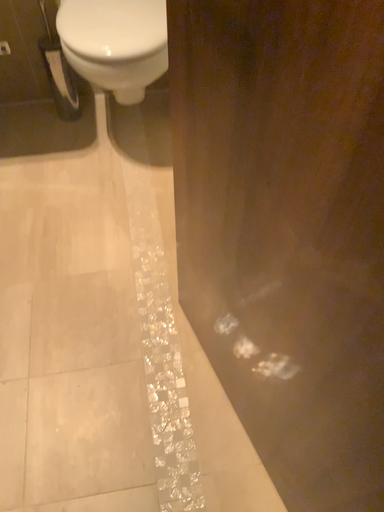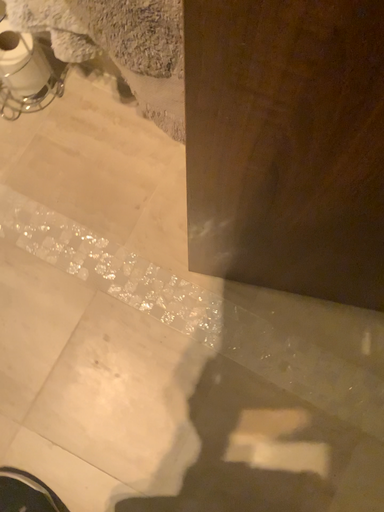
Question: How did the camera likely rotate when shooting the video?

Choices:
 (A) rotated right
 (B) rotated left

Answer: (A)